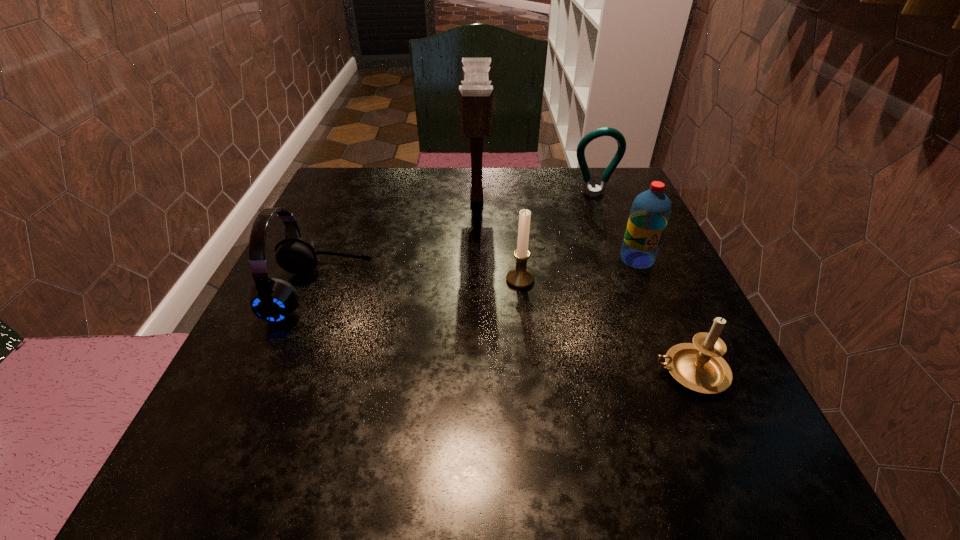
Find the location of a particular element. This screenshot has height=540, width=960. object that can be found as the closest to the water bottle is located at coordinates (520, 277).

The width and height of the screenshot is (960, 540). What are the coordinates of `object that stands as the third closest to the right candle holder` in the screenshot? It's located at (475, 92).

Where is `blank area in the image that satisfies the following two spatial constraints: 1. at the jaws of the bottle opener; 2. on the ear cushions of the leftmost object`? The width and height of the screenshot is (960, 540). blank area in the image that satisfies the following two spatial constraints: 1. at the jaws of the bottle opener; 2. on the ear cushions of the leftmost object is located at coordinates (631, 293).

Locate an element on the screen. The height and width of the screenshot is (540, 960). free space in the image that satisfies the following two spatial constraints: 1. at the jaws of the bottle opener; 2. on the ear cushions of the leftmost object is located at coordinates (631, 293).